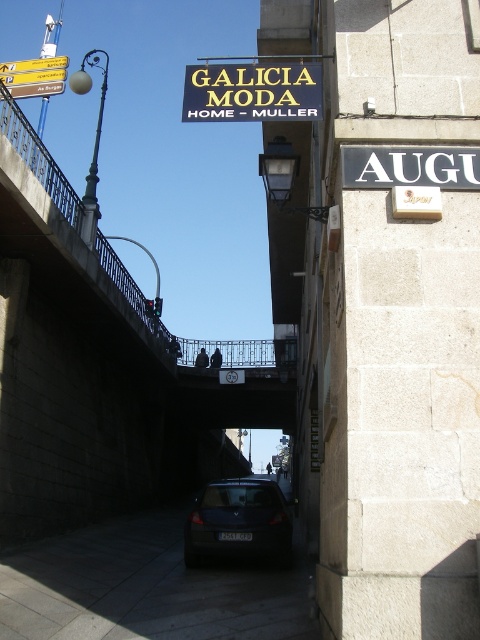
Question: Which of the following is the closest to the observer?

Choices:
 (A) metallic streetlamp at left
 (B) metallic signpost at upper left
 (C) dark gray matte car at center

Answer: (C)

Question: Where is concrete bridge at upper center located in relation to yellow plastic sign at upper center in the image?

Choices:
 (A) right
 (B) left

Answer: (A)

Question: Estimate the real-world distances between objects in this image. Which object is farther from the dark gray matte car at center?

Choices:
 (A) metallic signpost at upper left
 (B) yellow plastic sign at upper center
 (C) concrete bridge at upper center

Answer: (A)

Question: Which object is closer to the camera taking this photo?

Choices:
 (A) metallic streetlamp at left
 (B) dark gray matte car at center

Answer: (B)

Question: Can you confirm if dark gray matte car at center is smaller than metallic signpost at upper left?

Choices:
 (A) no
 (B) yes

Answer: (B)

Question: Is dark gray matte car at center bigger than metallic streetlamp at left?

Choices:
 (A) no
 (B) yes

Answer: (A)